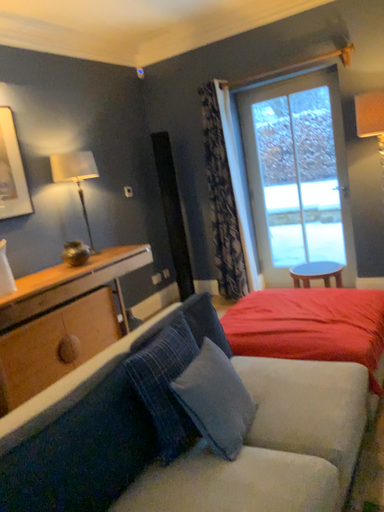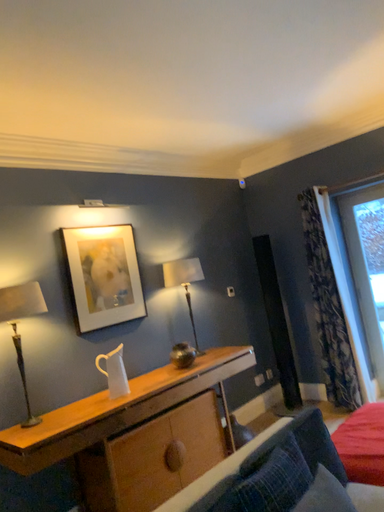
Question: How did the camera likely rotate when shooting the video?

Choices:
 (A) rotated left
 (B) rotated right

Answer: (A)